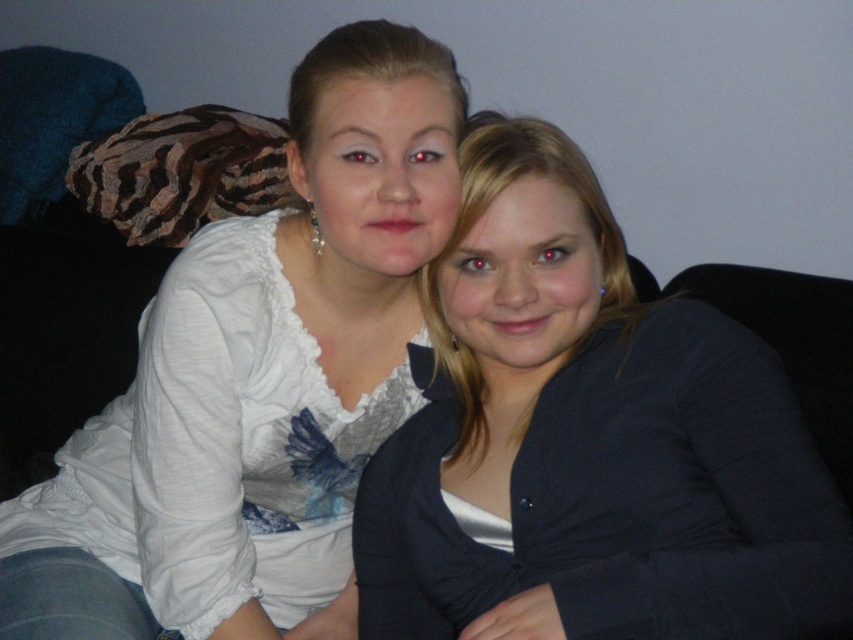
Can you confirm if matte black blazer at center is positioned to the left of white satin blouse at upper left?

No, matte black blazer at center is not to the left of white satin blouse at upper left.

Does point (592, 449) come closer to viewer compared to point (409, 177)?

No, (592, 449) is behind (409, 177).

Which is behind, point (402, 582) or point (318, 140)?

Positioned behind is point (402, 582).

This screenshot has width=853, height=640. Find the location of `matte black blazer at center`. matte black blazer at center is located at coordinates (589, 442).